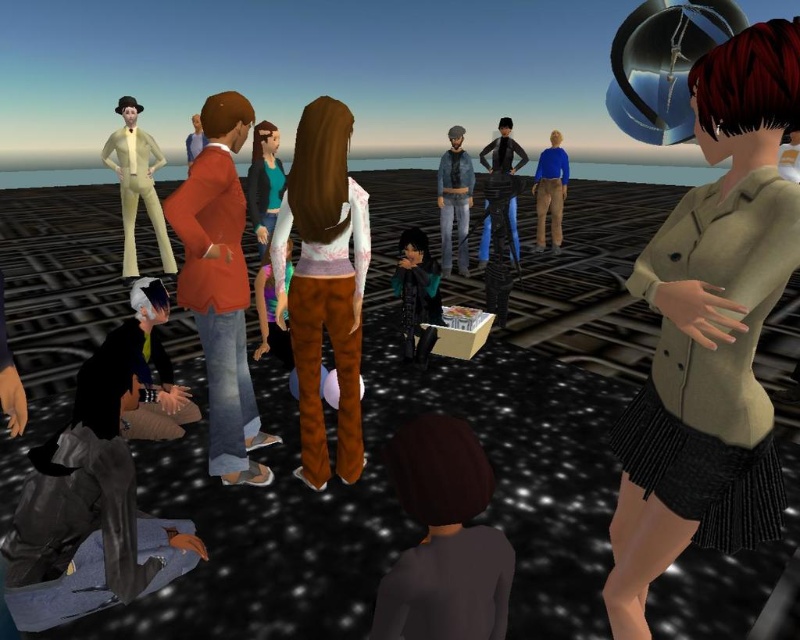
You are an avatar in the scene and want to grab the shiny black jacket at center. Can you reach it without moving your position?

The shiny black jacket at center is 3.74 meters away from you, so you cannot reach it without moving closer.

You are an avatar in the scene and want to reach the shiny black hair at lower left without stepping on the orange fabric jacket at center. Is this possible?

The orange fabric jacket at center is positioned over shiny black hair at lower left, so you can reach the shiny black hair at lower left by moving around the jacket since it is covering the hair from above.

You are an avatar in the scene and want to choose an outfit that is more compact to move around easily. Which of the following would you pick between the shiny black jacket at center and the blue matte shirt at center?

The shiny black jacket at center is smaller than the blue matte shirt at center, so it would be more compact and easier to move around in.